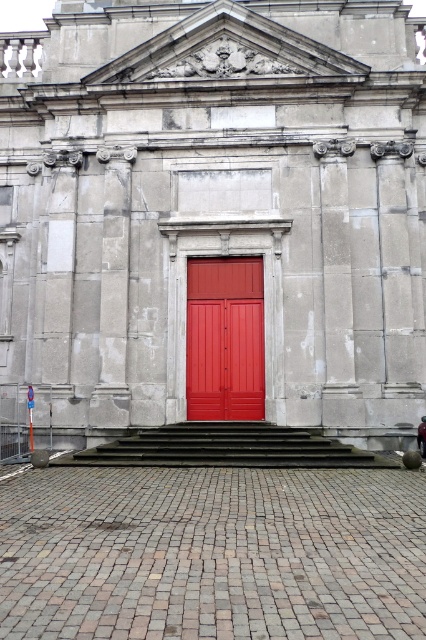
You are standing at the base of the smooth concrete stairs at center leading to the matte red door at center. Which object is closer to you as you ascend the stairs?

The smooth concrete stairs at center are closer to you as you ascend them, while the matte red door at center is further away. Since the door is positioned above the stairs, it is farther from your current position at the base.

You are standing in front of the classical building shown in the image. You need to locate the matte red door at center. Based on the building layout, where would you look to find it?

The matte red door at center is located at the central point of the building facade, specifically at the coordinates (224, 339).